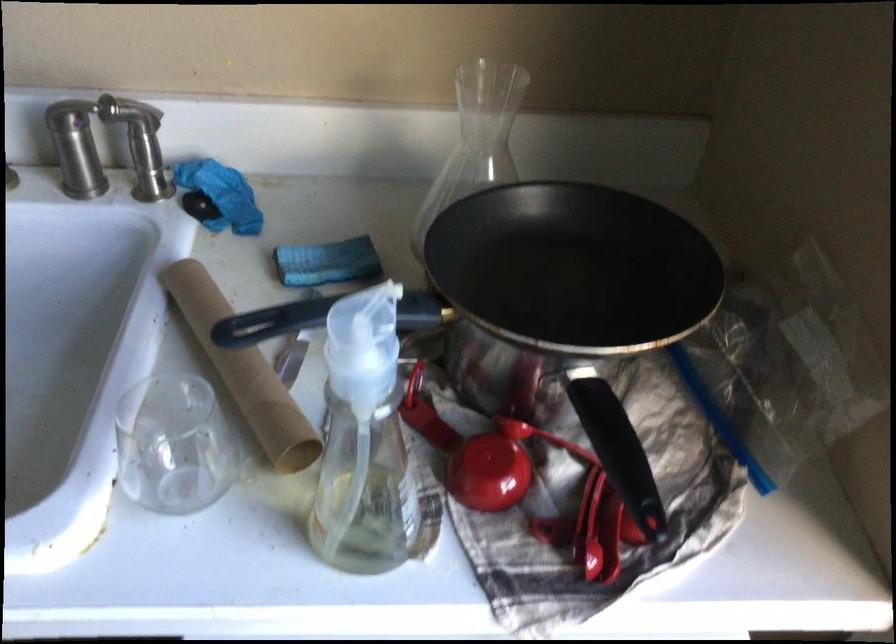
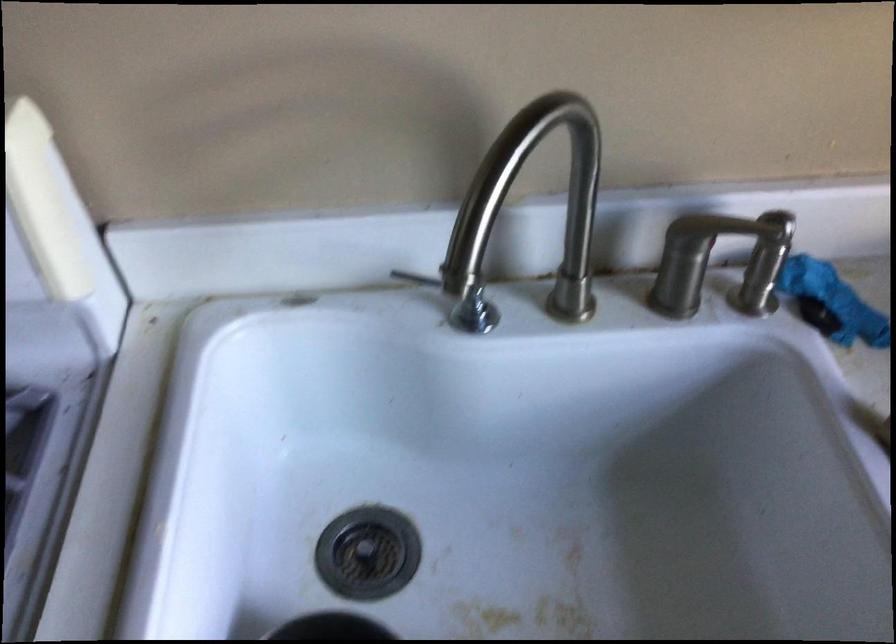
Question: The images are taken continuously from a first-person perspective. In which direction are you moving?

Choices:
 (A) Left
 (B) Right
 (C) Forward
 (D) Backward

Answer: (A)